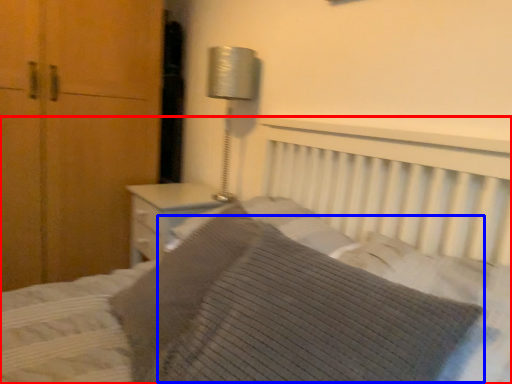
Question: Among these objects, which one is farthest to the camera, bed (highlighted by a red box) or pillow (highlighted by a blue box)?

Choices:
 (A) bed
 (B) pillow

Answer: (B)